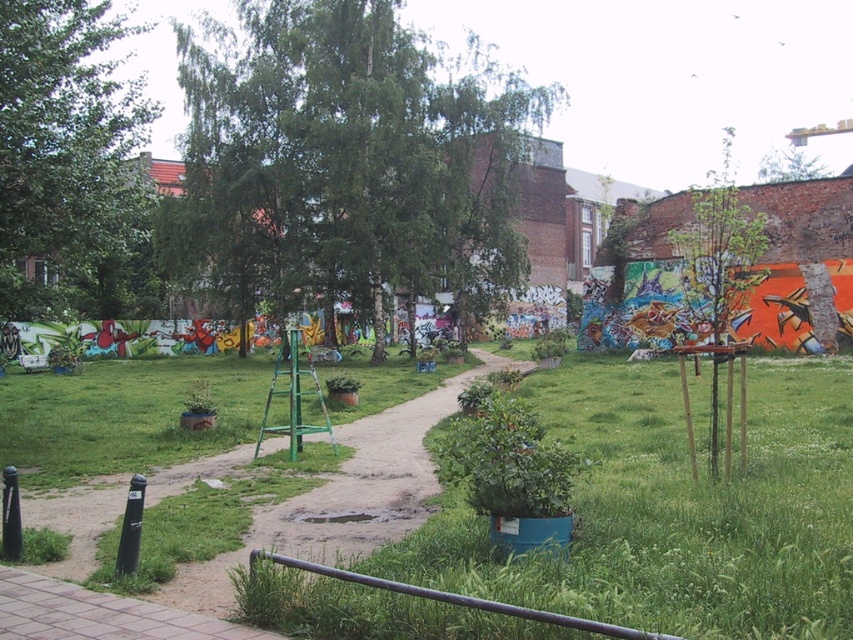
You are standing at the entrance of the park and want to take a photo of both the green leafy tree at upper left and the green leafy tree at upper right. Which tree should you focus on first to ensure both are in the frame?

You should focus on the green leafy tree at upper left first since it is closer to the viewer than the green leafy tree at upper right, ensuring both are in the frame by adjusting the camera angle to include the farther tree.

You are a park visitor who wants to take a photo of both the green leafy tree at center and the green leafy tree at upper right. Which tree should you stand closer to in order to capture both in the same frame?

You should stand closer to the green leafy tree at center because it is shorter than the green leafy tree at upper right, allowing both to fit within the camera frame when positioned appropriately.